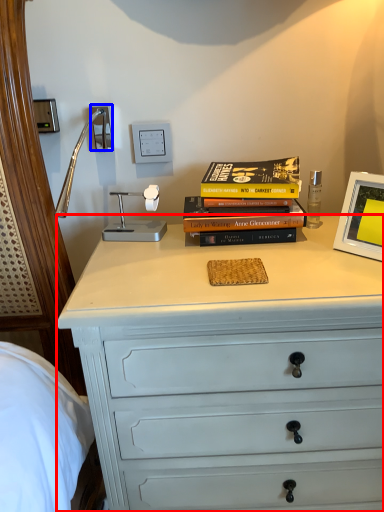
Question: Which point is closer to the camera, chest of drawers (highlighted by a red box) or electric outlet (highlighted by a blue box)?

Choices:
 (A) chest of drawers
 (B) electric outlet

Answer: (A)